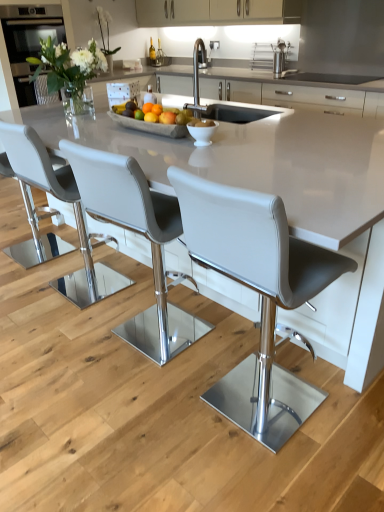
Question: Is matte black oven at upper left inside or outside of matte white cabinets at upper center?

Choices:
 (A) inside
 (B) outside

Answer: (B)

Question: In the image, is matte black oven at upper left positioned in front of or behind matte white cabinets at upper center?

Choices:
 (A) front
 (B) behind

Answer: (A)

Question: Estimate the real-world distances between objects in this image. Which object is closer to the yellow matte orange at center, positioned as the 2th orange in back-to-front order?

Choices:
 (A) stainless steel rack at upper center
 (B) white leather chair at left, positioned as the 2th chair in left-to-right order
 (C) matte black oven at upper left
 (D) orange matte at center, the first orange in the top-to-bottom sequence
 (E) white ceramic bowl at center

Answer: (D)

Question: Considering the real-world distances, which object is closest to the matte gray chair at center, which is the fourth chair in left-to-right order?

Choices:
 (A) white leather bar stool at left, the first chair positioned from the left
 (B) matte black oven at upper left
 (C) orange matte at center, positioned as the second orange in bottom-to-top order
 (D) matte white cabinets at upper center
 (E) white ceramic bowl at center

Answer: (E)